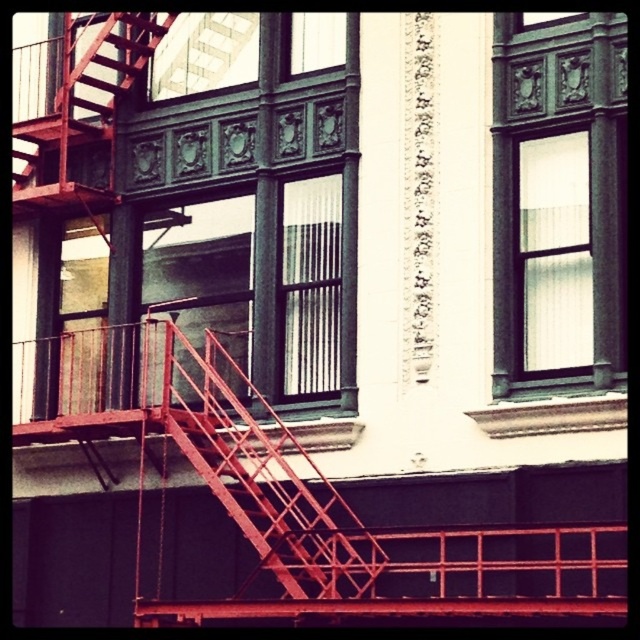
You are a painter who needs to paint the metallic red fire escape at center and the clear glass window at upper center. Which object requires more vertical space to paint?

The metallic red fire escape at center requires more vertical space to paint because it is much taller than the clear glass window at upper center.

You are standing on the sidewalk in front of the building and notice the metallic red fire escape at center and the clear glass window at upper right. Which object is closer to your left side?

The metallic red fire escape at center is to the left of the clear glass window at upper right, so from your perspective on the sidewalk, the metallic red fire escape at center would be closer to your left side.

You are standing in front of the building and want to determine the spatial relationship between the clear glass window at upper right and the clear glass window at upper center. Which window is positioned closer to you?

The clear glass window at upper right is closer to the viewer than the clear glass window at upper center.